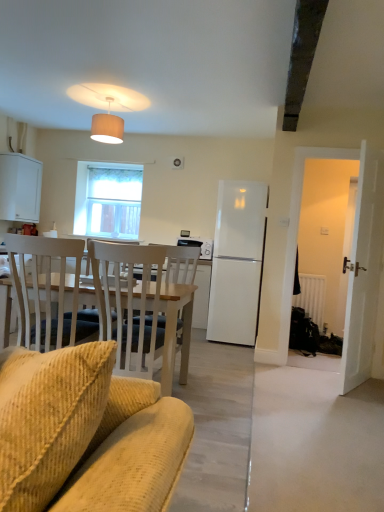
Question: From a real-world perspective, is beige ribbed lampshade at upper center physically located above or below satin black microwave at center?

Choices:
 (A) below
 (B) above

Answer: (B)

Question: Is beige ribbed lampshade at upper center bigger or smaller than satin black microwave at center?

Choices:
 (A) small
 (B) big

Answer: (B)

Question: Which object is the farthest from the white matte radiator at right?

Choices:
 (A) beige ribbed lampshade at upper center
 (B) translucent fabric at upper left
 (C) white matte refrigerator at center
 (D) dark gray metallic exhaust hood at upper right
 (E) satin black microwave at center

Answer: (A)

Question: Based on their relative distances, which object is farther from the beige ribbed lampshade at upper center?

Choices:
 (A) satin black microwave at center
 (B) white matte radiator at right
 (C) wooden chair at left
 (D) white matte cabinet at left
 (E) white matte refrigerator at center

Answer: (C)